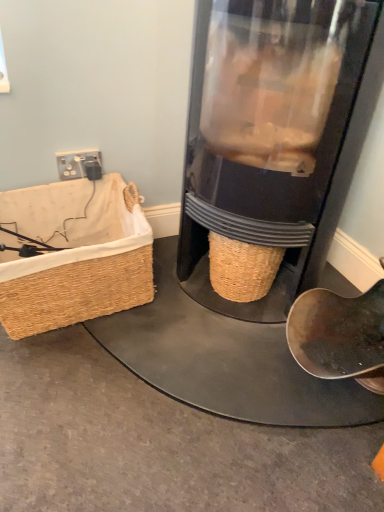
Locate an element on the screen. free space to the right of woven straw picnic basket at left is located at coordinates (190, 319).